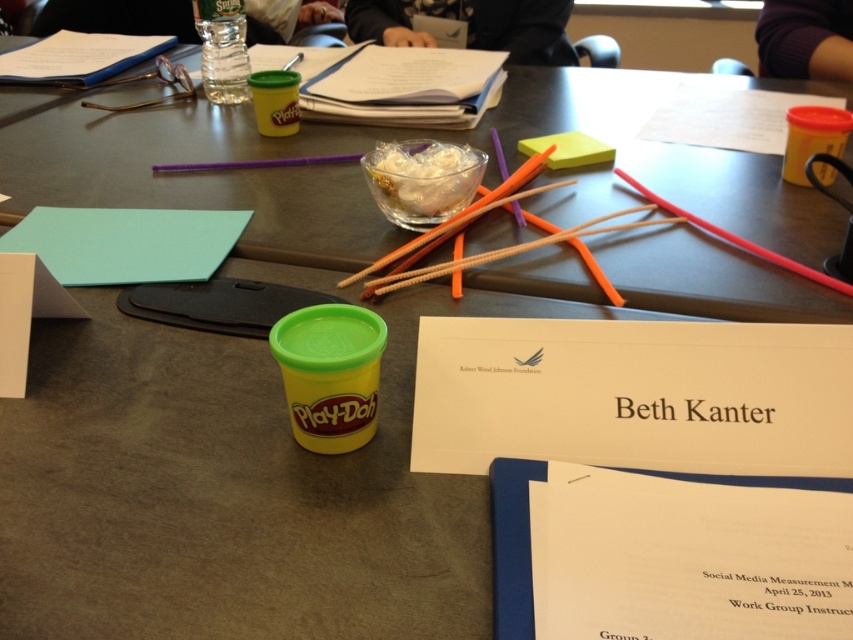
Question: Is green plastic play-doh at center to the right of yellow matte paper cup at upper right from the viewer's perspective?

Choices:
 (A) yes
 (B) no

Answer: (B)

Question: Which of the following is the closest to the observer?

Choices:
 (A) (793, 168)
 (B) (134, 218)

Answer: (B)

Question: Which point appears farthest from the camera in this image?

Choices:
 (A) (96, 72)
 (B) (602, 160)

Answer: (A)

Question: Among these objects, which one is nearest to the camera?

Choices:
 (A) yellow matte paper cup at upper right
 (B) white paper at upper left

Answer: (A)

Question: Is white cardstock at center bigger than yellow matte paper cup at upper right?

Choices:
 (A) no
 (B) yes

Answer: (A)

Question: Observing the image, what is the correct spatial positioning of white cardstock at center in reference to white paper at upper left?

Choices:
 (A) below
 (B) above

Answer: (A)